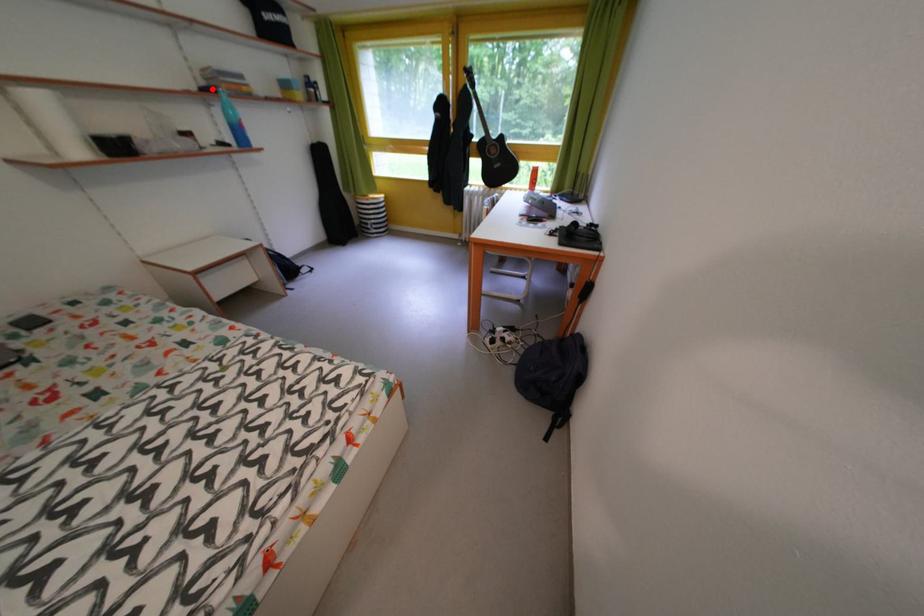
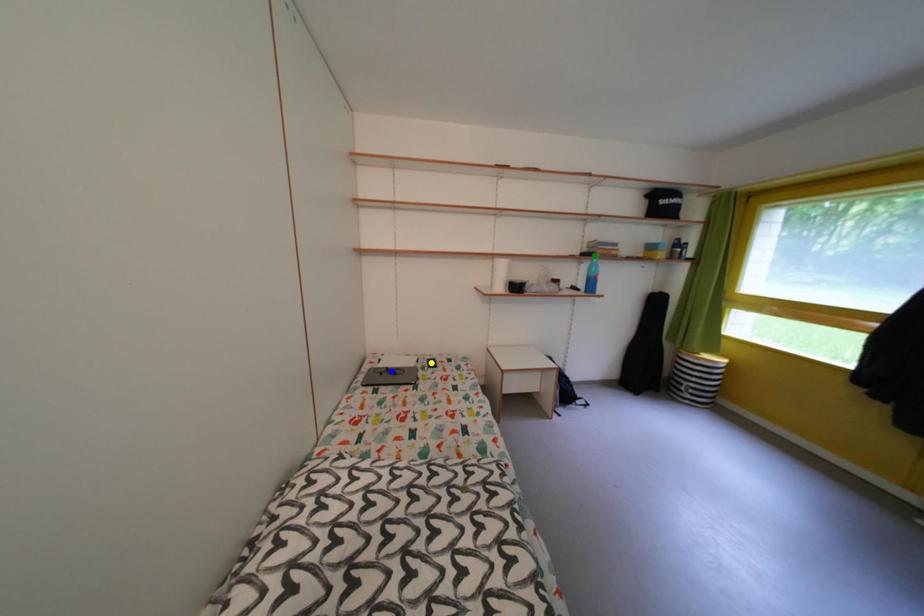
Question: I am providing you with two images of the same scene from different viewpoints. A red point is marked on the first image. You are given multiple points on the second image. Which spot in image 2 lines up with the point in image 1?

Choices:
 (A) blue point
 (B) green point
 (C) yellow point

Answer: (B)